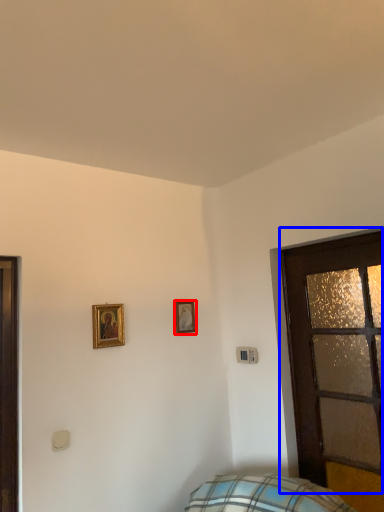
Question: Which object appears closest to the camera in this image, picture frame (highlighted by a red box) or door (highlighted by a blue box)?

Choices:
 (A) picture frame
 (B) door

Answer: (B)